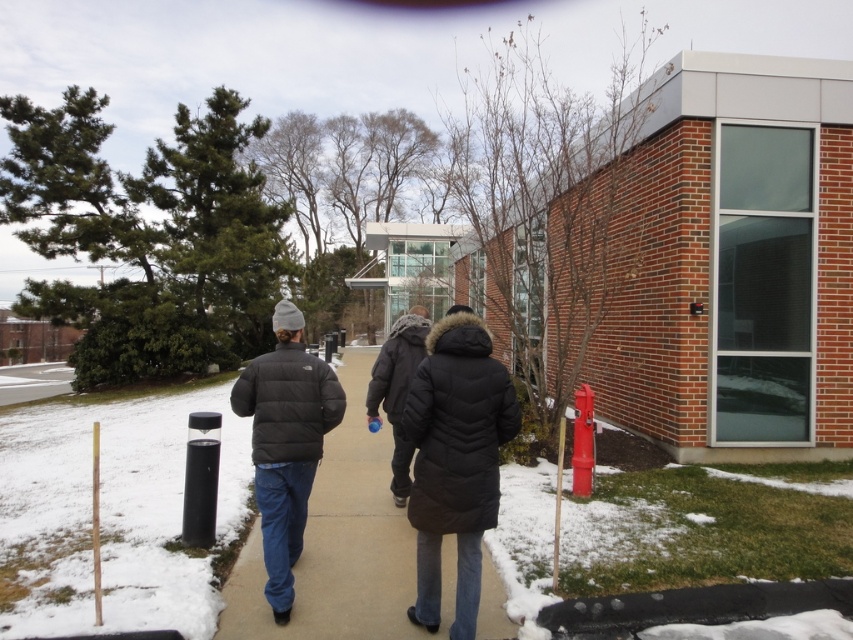
Question: Can you confirm if black puffer jacket at center is thinner than black puffer coat at center?

Choices:
 (A) yes
 (B) no

Answer: (B)

Question: Can you confirm if black puffer jacket at center is smaller than black puffer coat at center?

Choices:
 (A) yes
 (B) no

Answer: (B)

Question: Is matte black puffer jacket at center smaller than matte black jacket at center?

Choices:
 (A) yes
 (B) no

Answer: (A)

Question: Which object is farther from the camera taking this photo?

Choices:
 (A) black puffer coat at center
 (B) matte black puffer jacket at center
 (C) matte black jacket at center

Answer: (C)

Question: Which of the following is the farthest from the observer?

Choices:
 (A) black puffer jacket at center
 (B) matte black puffer jacket at center

Answer: (B)

Question: Which is farther from the matte black puffer jacket at center?

Choices:
 (A) black puffer jacket at center
 (B) black puffer coat at center
 (C) matte black jacket at center

Answer: (A)